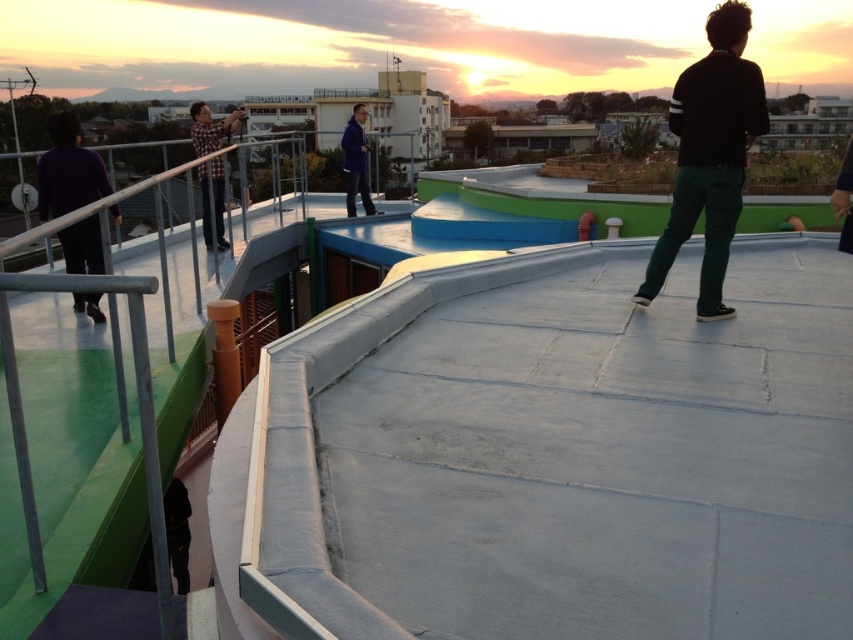
You are organizing a rooftop event and need to ensure there is enough space between the purple matte pants at left and the blue fabric jacket at center for a 1.2 meter wide equipment. Based on the scene, can the equipment fit between them?

The purple matte pants at left is bigger than the blue fabric jacket at center, but the description does not provide information about the distance between them. Therefore, it is impossible to determine if the equipment can fit between them.

You are standing on the rooftop and want to take a photo of the sunset. The purple matte pants at left and the blue fabric jacket at center are in your way. Which one is closer to you, making it the first obstacle you need to move?

The purple matte pants at left is in front of the blue fabric jacket at center, so the purple matte pants at left is closer to you and the first obstacle to move.